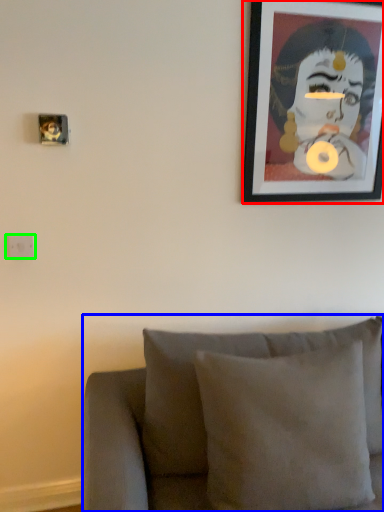
Question: Estimate the real-world distances between objects in this image. Which object is farther from picture frame (highlighted by a red box), furniture (highlighted by a blue box) or electric outlet (highlighted by a green box)?

Choices:
 (A) furniture
 (B) electric outlet

Answer: (B)